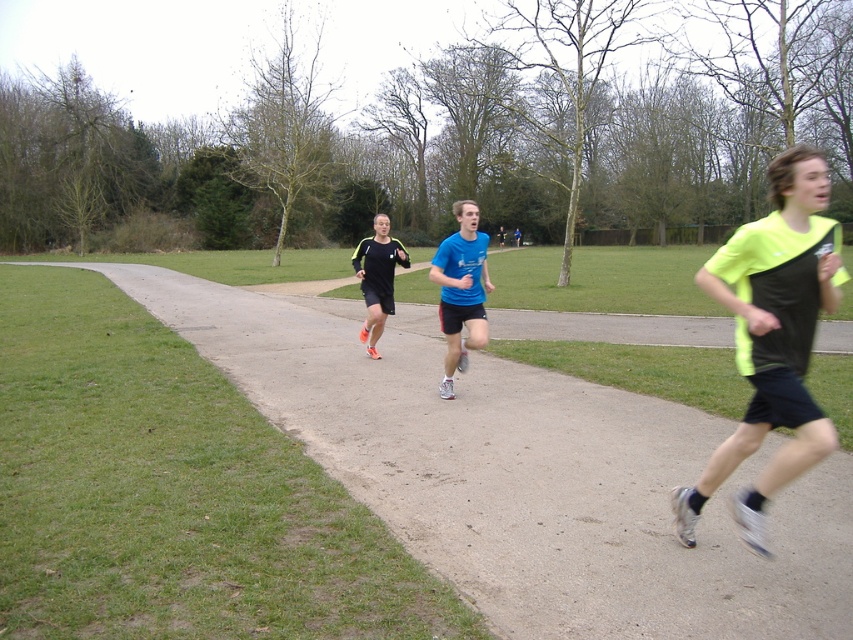
Where is `smooth asphalt path at center`? This screenshot has width=853, height=640. smooth asphalt path at center is located at coordinates (525, 474).

Does smooth asphalt path at center have a lesser height compared to blue matte shirt at center?

Indeed, smooth asphalt path at center has a lesser height compared to blue matte shirt at center.

Which is in front, point (795, 605) or point (456, 204)?

Point (795, 605) is in front.

This screenshot has height=640, width=853. Find the location of `smooth asphalt path at center`. smooth asphalt path at center is located at coordinates (525, 474).

Describe the element at coordinates (772, 337) in the screenshot. The height and width of the screenshot is (640, 853). I see `neon yellow fabric at center` at that location.

Does neon yellow fabric at center have a lesser height compared to blue matte shirt at center?

Incorrect, neon yellow fabric at center's height does not fall short of blue matte shirt at center's.

Is point (720, 472) less distant than point (489, 284)?

Yes, it is in front of point (489, 284).

Locate an element on the screen. neon yellow fabric at center is located at coordinates (772, 337).

In the scene shown: Between smooth asphalt path at center and neon yellow fabric at center, which one has less height?

smooth asphalt path at center

Who is positioned more to the right, smooth asphalt path at center or neon yellow fabric at center?

neon yellow fabric at center is more to the right.

Find the location of `smooth asphalt path at center`. smooth asphalt path at center is located at coordinates (525, 474).

This screenshot has width=853, height=640. In order to click on smooth asphalt path at center in this screenshot , I will do `click(525, 474)`.